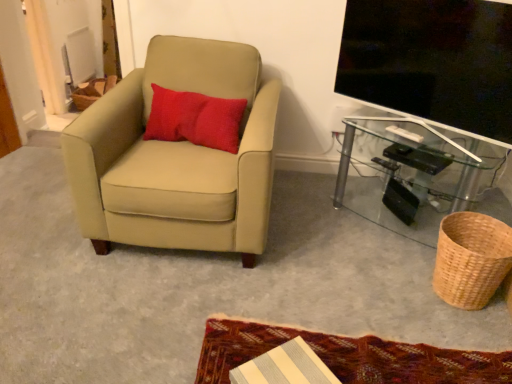
At what (x,y) coordinates should I click in order to perform the action: click on free space between woven natural basket at lower right and textured woolen mat at lower center. Please return your answer as a coordinate pair (x, y). Looking at the image, I should click on (366, 292).